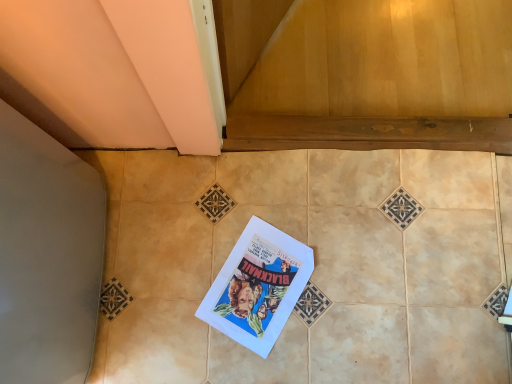
Question: Considering the relative positions of beige ceramic tile at center and white paper comic book at center in the image provided, is beige ceramic tile at center to the left of white paper comic book at center from the viewer's perspective?

Choices:
 (A) yes
 (B) no

Answer: (B)

Question: Is beige ceramic tile at center facing away from white paper comic book at center?

Choices:
 (A) yes
 (B) no

Answer: (A)

Question: From the image's perspective, is beige ceramic tile at center beneath white paper comic book at center?

Choices:
 (A) yes
 (B) no

Answer: (B)

Question: From the image's perspective, is beige ceramic tile at center on white paper comic book at center?

Choices:
 (A) no
 (B) yes

Answer: (B)

Question: From a real-world perspective, is beige ceramic tile at center on white paper comic book at center?

Choices:
 (A) yes
 (B) no

Answer: (A)

Question: From a real-world perspective, is beige ceramic tile at center below white paper comic book at center?

Choices:
 (A) no
 (B) yes

Answer: (A)

Question: Considering the relative sizes of white paper comic book at center and beige ceramic tile at center in the image provided, is white paper comic book at center taller than beige ceramic tile at center?

Choices:
 (A) no
 (B) yes

Answer: (A)

Question: From a real-world perspective, is white paper comic book at center positioned over beige ceramic tile at center based on gravity?

Choices:
 (A) yes
 (B) no

Answer: (B)

Question: Is white paper comic book at center surrounding beige ceramic tile at center?

Choices:
 (A) no
 (B) yes

Answer: (A)

Question: Is white paper comic book at center looking in the opposite direction of beige ceramic tile at center?

Choices:
 (A) yes
 (B) no

Answer: (A)

Question: Does white paper comic book at center turn towards beige ceramic tile at center?

Choices:
 (A) yes
 (B) no

Answer: (A)

Question: Is white paper comic book at center bigger than beige ceramic tile at center?

Choices:
 (A) no
 (B) yes

Answer: (A)

Question: In the image, is white paper comic book at center positioned in front of or behind beige ceramic tile at center?

Choices:
 (A) behind
 (B) front

Answer: (A)